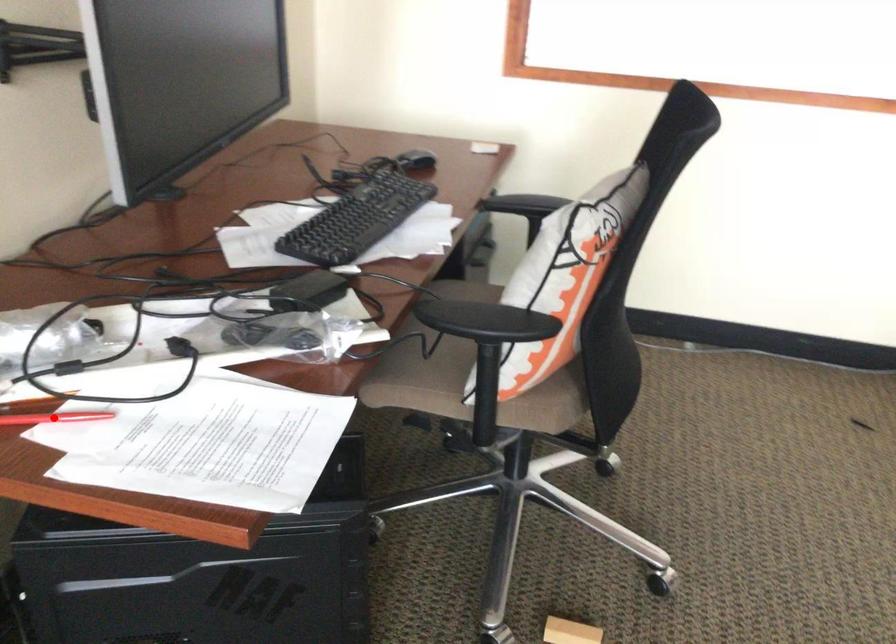
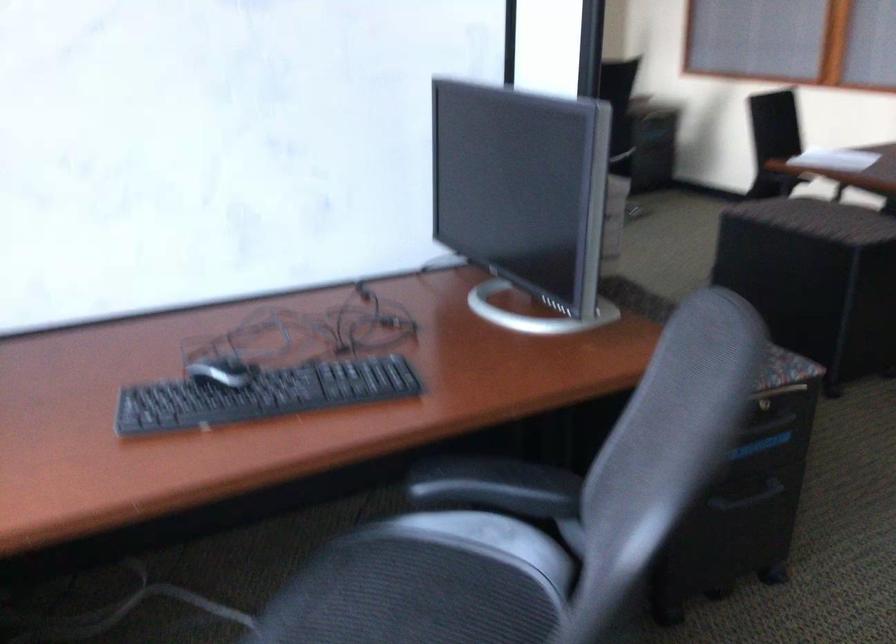
Question: I am providing you with two images of the same scene from different viewpoints. A red point is marked on the first image. Is the red point's position out of view in image 2?

Choices:
 (A) Yes
 (B) No

Answer: (A)